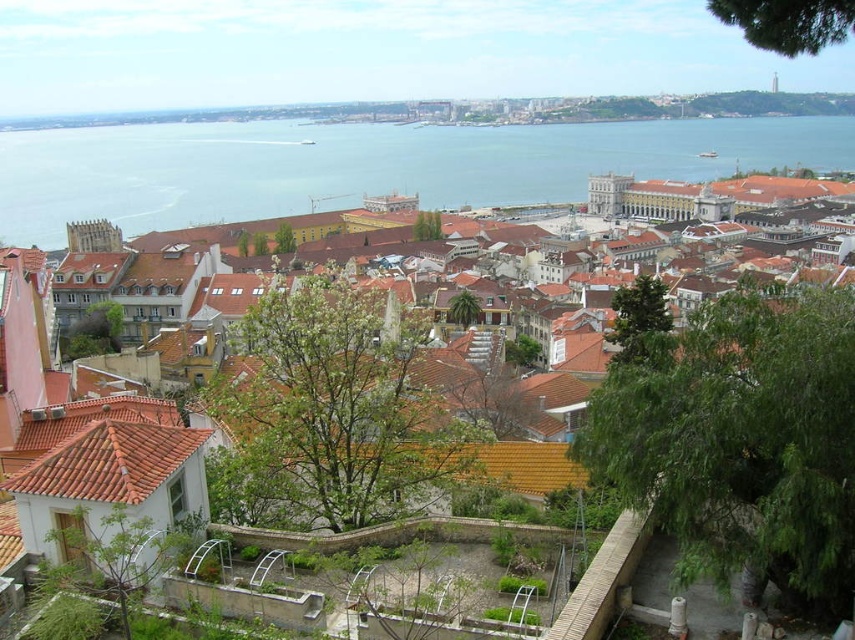
From the picture: Who is higher up, brown tiled roofs at center or blue water at center?

blue water at center is above.

What are the coordinates of `brown tiled roofs at center` in the screenshot? It's located at (740, 435).